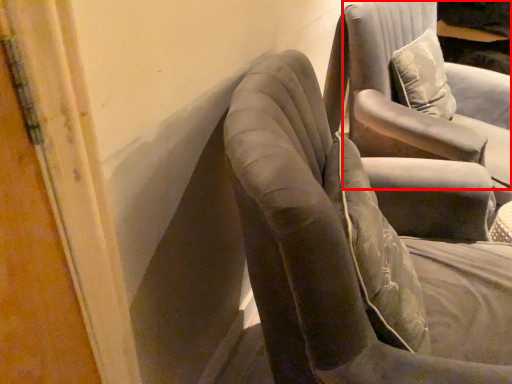
Question: From the image's perspective, considering the relative positions of chair (annotated by the red box) and chair in the image provided, where is chair (annotated by the red box) located with respect to the staircase?

Choices:
 (A) above
 (B) below

Answer: (A)